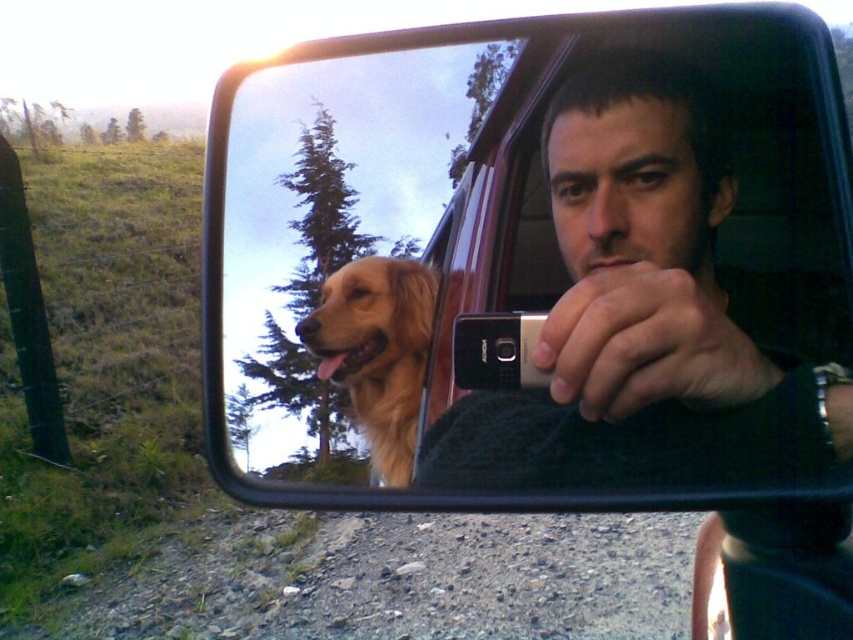
Question: Is the position of matte black phone at center more distant than that of golden fur dog at upper left?

Choices:
 (A) no
 (B) yes

Answer: (A)

Question: Which of the following is the farthest from the observer?

Choices:
 (A) golden fur dog at center
 (B) matte black phone at center

Answer: (A)

Question: Does matte black phone at center have a greater width compared to golden fur dog at center?

Choices:
 (A) no
 (B) yes

Answer: (B)

Question: Which of these objects is positioned closest to the golden fur dog at center?

Choices:
 (A) golden fur dog at upper left
 (B) matte black phone at center

Answer: (A)

Question: Which object is farther from the camera taking this photo?

Choices:
 (A) golden fur dog at center
 (B) golden fur dog at upper left
 (C) matte black phone at center

Answer: (A)

Question: Does golden fur dog at upper left have a greater width compared to golden fur dog at center?

Choices:
 (A) no
 (B) yes

Answer: (B)